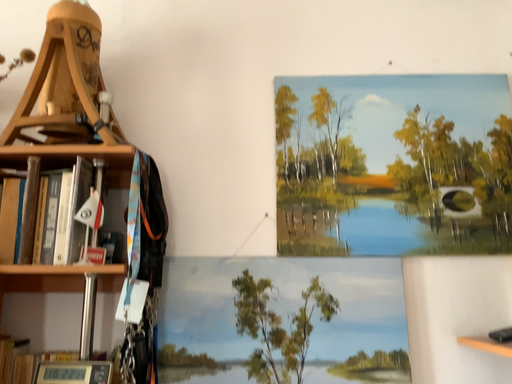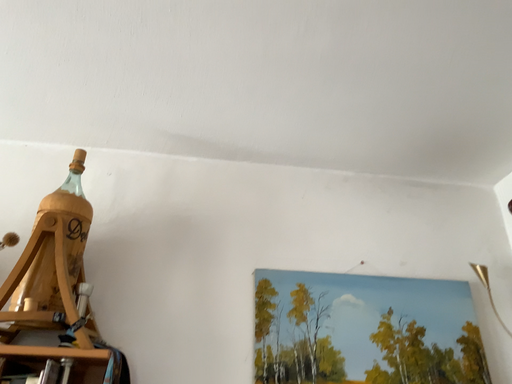
Question: Which way did the camera rotate in the video?

Choices:
 (A) rotated upward
 (B) rotated downward

Answer: (A)